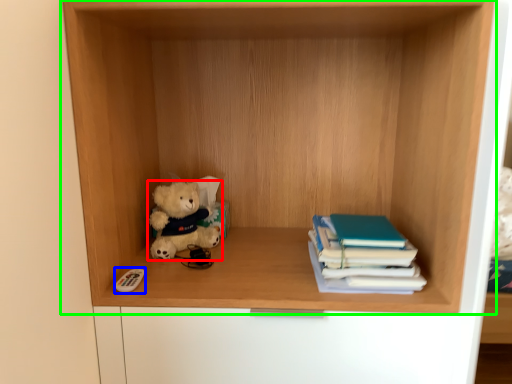
Question: Based on their relative distances, which object is nearer to teddy bear (highlighted by a red box)? Choose from toy (highlighted by a blue box) and shelf (highlighted by a green box).

Choices:
 (A) toy
 (B) shelf

Answer: (A)